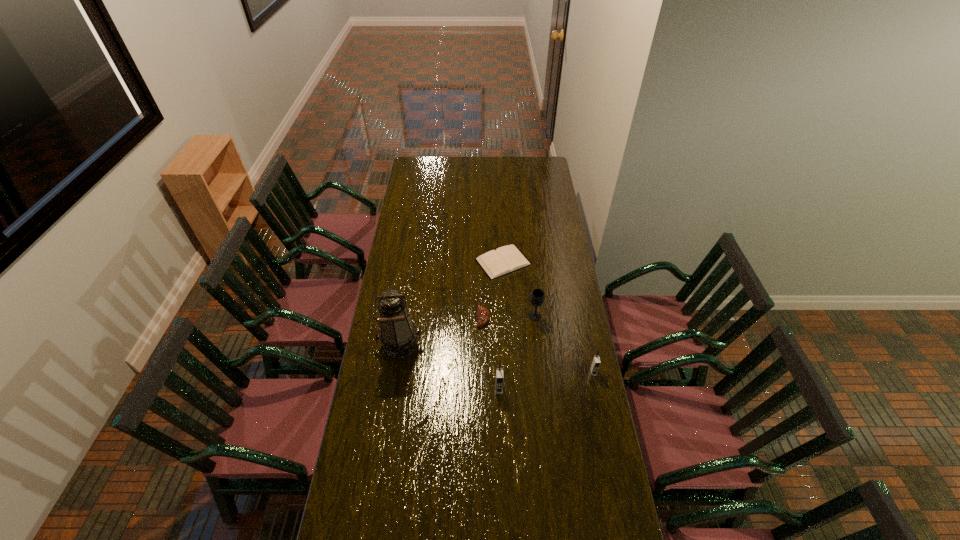
Where is `free location at the right edge`? The height and width of the screenshot is (540, 960). free location at the right edge is located at coordinates (575, 386).

In the image, there is a desktop. In order to click on free space at the far left corner in this screenshot , I will do `click(433, 161)`.

Where is `vacant space at the near left corner of the desktop`? This screenshot has height=540, width=960. vacant space at the near left corner of the desktop is located at coordinates (345, 525).

Identify the location of vacant region at the far right corner. (549, 167).

Locate an element on the screen. This screenshot has width=960, height=540. blank region between the right cellular telephone and the crescent roll is located at coordinates (539, 345).

Where is `blank region between the hardback book and the crescent roll`? The image size is (960, 540). blank region between the hardback book and the crescent roll is located at coordinates (493, 290).

Identify the location of empty location between the right cellular telephone and the shortest object. This screenshot has height=540, width=960. (548, 317).

Locate an element on the screen. The image size is (960, 540). free space between the leftmost object and the second shortest object is located at coordinates (442, 332).

Where is `blank region between the second shortest object and the hardback book`? This screenshot has height=540, width=960. blank region between the second shortest object and the hardback book is located at coordinates (493, 290).

Image resolution: width=960 pixels, height=540 pixels. What are the coordinates of `blank region between the wineglass and the nearer cellular telephone` in the screenshot? It's located at (517, 352).